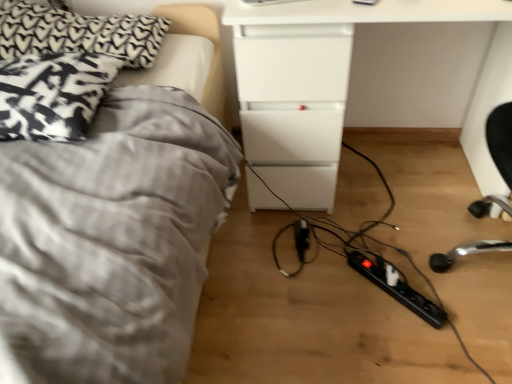
I want to click on white glossy drawer at center, so click(340, 83).

I want to click on black textured pillow at upper left, which is the first pillow from top to bottom, so click(x=78, y=33).

Who is smaller, black textured pillow at upper left, which is the first pillow from top to bottom, or patterned fabric pillow at left, marked as the 2th pillow in a top-to-bottom arrangement?

patterned fabric pillow at left, marked as the 2th pillow in a top-to-bottom arrangement, is smaller.

Can you confirm if black textured pillow at upper left, the second pillow positioned from the bottom, is positioned to the right of patterned fabric pillow at left, marked as the 1th pillow in a bottom-to-top arrangement?

No, black textured pillow at upper left, the second pillow positioned from the bottom, is not to the right of patterned fabric pillow at left, marked as the 1th pillow in a bottom-to-top arrangement.

Is the position of black textured pillow at upper left, the second pillow positioned from the bottom, less distant than that of patterned fabric pillow at left, marked as the 2th pillow in a top-to-bottom arrangement?

No, black textured pillow at upper left, the second pillow positioned from the bottom, is further to the viewer.

Between black textured pillow at upper left, the second pillow positioned from the bottom, and patterned fabric pillow at left, marked as the 1th pillow in a bottom-to-top arrangement, which one has less height?

With less height is patterned fabric pillow at left, marked as the 1th pillow in a bottom-to-top arrangement.

From the image's perspective, is gray fabric bed at left located beneath white glossy drawer at center?

Yes, from the image's perspective, gray fabric bed at left is beneath white glossy drawer at center.

Which object is wider, gray fabric bed at left or white glossy drawer at center?

gray fabric bed at left.

Are gray fabric bed at left and white glossy drawer at center beside each other?

gray fabric bed at left is not next to white glossy drawer at center, and they're not touching.

In the scene shown: Considering the positions of objects gray fabric bed at left and white glossy drawer at center in the image provided, who is more to the right, gray fabric bed at left or white glossy drawer at center?

Positioned to the right is white glossy drawer at center.

Could you measure the distance between patterned fabric pillow at left, marked as the 2th pillow in a top-to-bottom arrangement, and black textured pillow at upper left, the second pillow positioned from the bottom?

patterned fabric pillow at left, marked as the 2th pillow in a top-to-bottom arrangement, and black textured pillow at upper left, the second pillow positioned from the bottom, are 8.28 inches apart from each other.

Does point (95, 71) appear closer or farther from the camera than point (40, 35)?

Point (95, 71) is positioned closer to the camera compared to point (40, 35).

Locate an element on the screen. The height and width of the screenshot is (384, 512). pillow below the patterned fabric pillow at left, marked as the 2th pillow in a top-to-bottom arrangement (from a real-world perspective) is located at coordinates (78, 33).

From a real-world perspective, does patterned fabric pillow at left, marked as the 2th pillow in a top-to-bottom arrangement, sit lower than black textured pillow at upper left, the second pillow positioned from the bottom?

Incorrect, from a real-world perspective, patterned fabric pillow at left, marked as the 2th pillow in a top-to-bottom arrangement, is higher than black textured pillow at upper left, the second pillow positioned from the bottom.

The width and height of the screenshot is (512, 384). What are the coordinates of `extension cord that is the 1st object to the right of the gray fabric bed at left, starting at the anchor` in the screenshot? It's located at (301, 238).

Is gray fabric bed at left wider or thinner than black plastic extension cord at center, which is the first extension cord in top-to-bottom order?

Considering their sizes, gray fabric bed at left looks broader than black plastic extension cord at center, which is the first extension cord in top-to-bottom order.

Is black plastic extension cord at center, which appears as the 2th extension cord when viewed from the right, inside gray fabric bed at left?

No, black plastic extension cord at center, which appears as the 2th extension cord when viewed from the right, is not a part of gray fabric bed at left.

Could you measure the distance between gray fabric bed at left and black plastic extension cord at center, which appears as the 2th extension cord when viewed from the right?

They are 27.20 inches apart.

From their relative heights in the image, would you say black plastic extension cord at center, the second extension cord from the bottom, is taller or shorter than patterned fabric pillow at left, marked as the 1th pillow in a bottom-to-top arrangement?

black plastic extension cord at center, the second extension cord from the bottom, is shorter than patterned fabric pillow at left, marked as the 1th pillow in a bottom-to-top arrangement.

Which is nearer, (302, 228) or (108, 55)?

Clearly, point (302, 228) is more distant from the camera than point (108, 55).

Is black plastic extension cord at center, acting as the 1th extension cord starting from the left, positioned with its back to patterned fabric pillow at left, marked as the 1th pillow in a bottom-to-top arrangement?

No, black plastic extension cord at center, acting as the 1th extension cord starting from the left, is not facing away from patterned fabric pillow at left, marked as the 1th pillow in a bottom-to-top arrangement.

Based on their positions, is black plastic extension cord at center, the 1th extension cord from the back, located to the left or right of patterned fabric pillow at left, marked as the 2th pillow in a top-to-bottom arrangement?

Clearly, black plastic extension cord at center, the 1th extension cord from the back, is on the right of patterned fabric pillow at left, marked as the 2th pillow in a top-to-bottom arrangement, in the image.

Considering the sizes of objects patterned fabric pillow at left, marked as the 2th pillow in a top-to-bottom arrangement, and black plastic extension cord at lower right, placed as the second extension cord when sorted from left to right, in the image provided, who is taller, patterned fabric pillow at left, marked as the 2th pillow in a top-to-bottom arrangement, or black plastic extension cord at lower right, placed as the second extension cord when sorted from left to right,?

With more height is patterned fabric pillow at left, marked as the 2th pillow in a top-to-bottom arrangement.

Where is `pillow that is the 1st object located above the black plastic extension cord at lower right, the 2th extension cord when ordered from back to front (from the image's perspective)`? pillow that is the 1st object located above the black plastic extension cord at lower right, the 2th extension cord when ordered from back to front (from the image's perspective) is located at coordinates tap(53, 94).

Considering the relative sizes of patterned fabric pillow at left, marked as the 2th pillow in a top-to-bottom arrangement, and black plastic extension cord at lower right, the first extension cord from the front, in the image provided, is patterned fabric pillow at left, marked as the 2th pillow in a top-to-bottom arrangement, thinner than black plastic extension cord at lower right, the first extension cord from the front,?

No.

Which object is further away from the camera, gray fabric bed at left or patterned fabric pillow at left, marked as the 2th pillow in a top-to-bottom arrangement?

patterned fabric pillow at left, marked as the 2th pillow in a top-to-bottom arrangement.

From a real-world perspective, does gray fabric bed at left stand above patterned fabric pillow at left, marked as the 1th pillow in a bottom-to-top arrangement?

Incorrect, from a real-world perspective, gray fabric bed at left is lower than patterned fabric pillow at left, marked as the 1th pillow in a bottom-to-top arrangement.

Measure the distance between gray fabric bed at left and patterned fabric pillow at left, marked as the 1th pillow in a bottom-to-top arrangement.

gray fabric bed at left and patterned fabric pillow at left, marked as the 1th pillow in a bottom-to-top arrangement, are 7.98 inches apart.

In the scene shown: Does gray fabric bed at left appear on the right side of patterned fabric pillow at left, marked as the 2th pillow in a top-to-bottom arrangement?

Yes, gray fabric bed at left is to the right of patterned fabric pillow at left, marked as the 2th pillow in a top-to-bottom arrangement.

Where is `pillow below the patterned fabric pillow at left, marked as the 1th pillow in a bottom-to-top arrangement (from a real-world perspective)`? Image resolution: width=512 pixels, height=384 pixels. pillow below the patterned fabric pillow at left, marked as the 1th pillow in a bottom-to-top arrangement (from a real-world perspective) is located at coordinates (78, 33).

Find the location of a particular element. bed below the white glossy drawer at center (from the image's perspective) is located at coordinates (110, 241).

Estimate the real-world distances between objects in this image. Which object is closer to gray fabric bed at left, patterned fabric pillow at left, marked as the 1th pillow in a bottom-to-top arrangement, or black textured pillow at upper left, which is the first pillow from top to bottom?

Among the two, patterned fabric pillow at left, marked as the 1th pillow in a bottom-to-top arrangement, is located nearer to gray fabric bed at left.

When comparing their distances from black plastic extension cord at lower right, placed as the second extension cord when sorted from left to right, does gray fabric bed at left or patterned fabric pillow at left, marked as the 2th pillow in a top-to-bottom arrangement, seem closer?

gray fabric bed at left lies closer to black plastic extension cord at lower right, placed as the second extension cord when sorted from left to right, than the other object.

Based on the photo, estimate the real-world distances between objects in this image. Which object is closer to black plastic extension cord at center, the second extension cord from the bottom, patterned fabric pillow at left, marked as the 1th pillow in a bottom-to-top arrangement, or black plastic extension cord at lower right, the first extension cord when ordered from bottom to top?

black plastic extension cord at lower right, the first extension cord when ordered from bottom to top, lies closer to black plastic extension cord at center, the second extension cord from the bottom, than the other object.

From the image, which object appears to be nearer to white glossy drawer at center, black plastic extension cord at center, the second extension cord from the bottom, or black plastic extension cord at lower right, the 2th extension cord when ordered from back to front?

Based on the image, black plastic extension cord at center, the second extension cord from the bottom, appears to be nearer to white glossy drawer at center.

From the image, which object appears to be farther from black textured pillow at upper left, which is the first pillow from top to bottom, black plastic extension cord at lower right, the first extension cord from the front, or patterned fabric pillow at left, marked as the 2th pillow in a top-to-bottom arrangement?

black plastic extension cord at lower right, the first extension cord from the front, is positioned further to the anchor black textured pillow at upper left, which is the first pillow from top to bottom.

Based on the photo, from the image, which object appears to be farther from white glossy drawer at center, patterned fabric pillow at left, marked as the 2th pillow in a top-to-bottom arrangement, or gray fabric bed at left?

Based on the image, patterned fabric pillow at left, marked as the 2th pillow in a top-to-bottom arrangement, appears to be further to white glossy drawer at center.

Based on their spatial positions, is black textured pillow at upper left, which is the first pillow from top to bottom, or white glossy drawer at center further from black plastic extension cord at lower right, the 2th extension cord when ordered from back to front?

black textured pillow at upper left, which is the first pillow from top to bottom, is positioned further to the anchor black plastic extension cord at lower right, the 2th extension cord when ordered from back to front.

When comparing their distances from patterned fabric pillow at left, marked as the 2th pillow in a top-to-bottom arrangement, does black textured pillow at upper left, which is the first pillow from top to bottom, or black plastic extension cord at lower right, the first extension cord when ordered from bottom to top, seem closer?

The object closer to patterned fabric pillow at left, marked as the 2th pillow in a top-to-bottom arrangement, is black textured pillow at upper left, which is the first pillow from top to bottom.

Find the location of a particular element. The width and height of the screenshot is (512, 384). bed situated between patterned fabric pillow at left, marked as the 1th pillow in a bottom-to-top arrangement, and white glossy drawer at center from left to right is located at coordinates (110, 241).

The image size is (512, 384). What are the coordinates of `extension cord between gray fabric bed at left and black plastic extension cord at center, which is the first extension cord in top-to-bottom order, from front to back` in the screenshot? It's located at (397, 288).

Find the location of a particular element. extension cord between black textured pillow at upper left, the second pillow positioned from the bottom, and white glossy drawer at center from left to right is located at coordinates (301, 238).

Find the location of a particular element. table between patterned fabric pillow at left, marked as the 1th pillow in a bottom-to-top arrangement, and black plastic extension cord at lower right, the first extension cord positioned from the right is located at coordinates (340, 83).